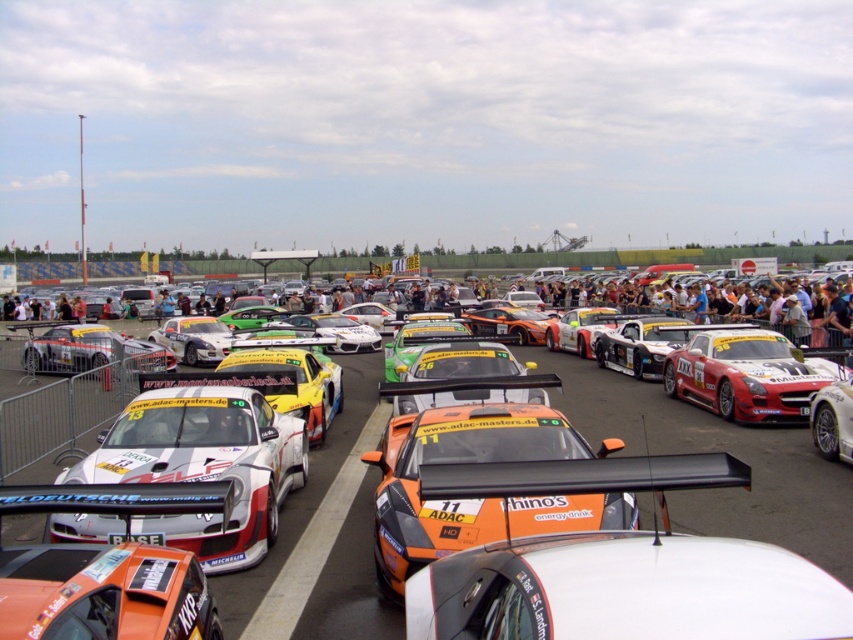
Question: Which point is closer to the camera?

Choices:
 (A) orange glossy race car at center
 (B) orange matte race car at center
 (C) red matte sports car at center
 (D) orange glossy car at center

Answer: (B)

Question: Can you confirm if orange glossy car at center is smaller than red matte sports car at center?

Choices:
 (A) no
 (B) yes

Answer: (A)

Question: Does orange matte race car at center appear on the right side of white glossy race car at center?

Choices:
 (A) no
 (B) yes

Answer: (B)

Question: Which point is closer to the camera?

Choices:
 (A) orange glossy race car at center
 (B) red matte sports car at center

Answer: (A)

Question: Where is white glossy race car at center located in relation to red matte sports car at center in the image?

Choices:
 (A) below
 (B) above

Answer: (A)

Question: Which point is farther from the camera taking this photo?

Choices:
 (A) (793, 538)
 (B) (724, 355)
 (C) (186, 461)
 (D) (741, 625)

Answer: (B)